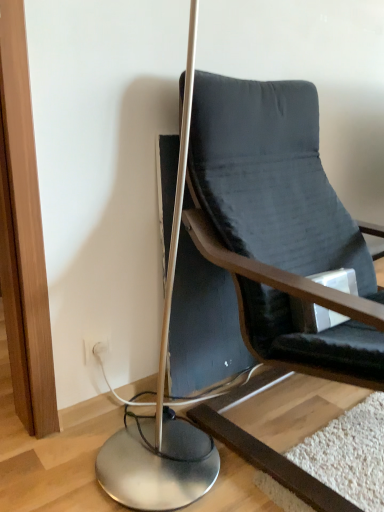
At what (x,y) coordinates should I click in order to perform the action: click on dark gray fabric chair at center. Please return your answer as a coordinate pair (x, y). The image size is (384, 512). Looking at the image, I should click on (280, 226).

What is the approximate height of dark gray fabric chair at center?

dark gray fabric chair at center is 37.41 inches in height.

Image resolution: width=384 pixels, height=512 pixels. Describe the element at coordinates (280, 226) in the screenshot. I see `dark gray fabric chair at center` at that location.

You are a GUI agent. You are given a task and a screenshot of the screen. Output one action in this format:
    pyautogui.click(x=<x>, y=<y>)
    Task: Click on the dark gray fabric chair at center
    This screenshot has width=384, height=512.
    Given the screenshot: What is the action you would take?
    pyautogui.click(x=280, y=226)